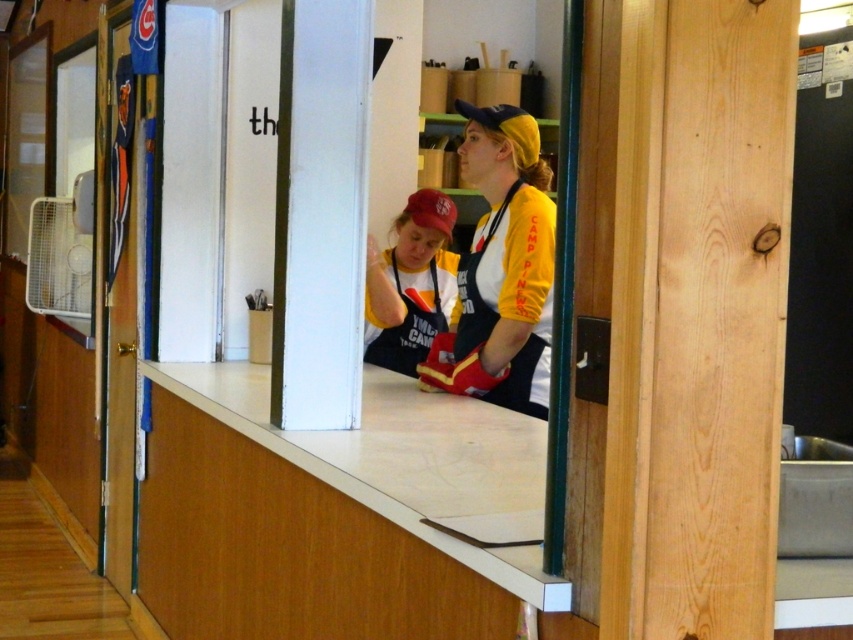
You are a chef in this kitchen and need to quickly grab the yellow matte baseball cap at upper center. Which direction should you move relative to the matte red baseball cap at center?

The yellow matte baseball cap at upper center is positioned on the right side of the matte red baseball cap at center, so you should move to the right relative to the matte red baseball cap at center to grab it.